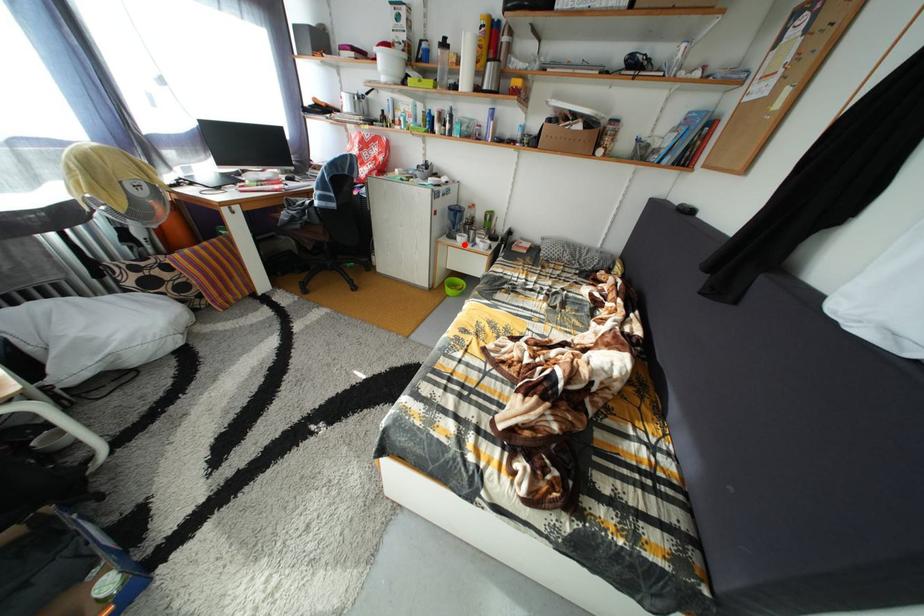
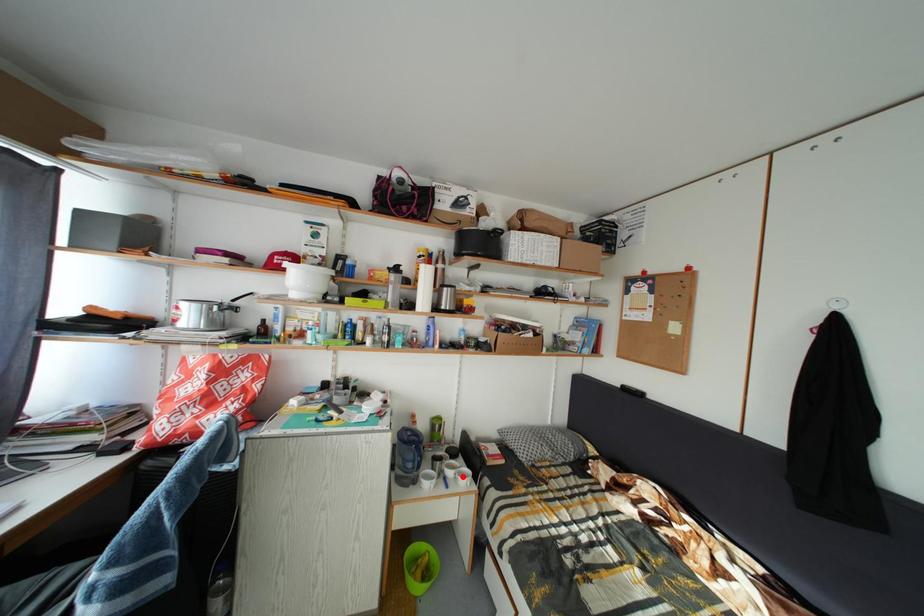
I am providing you with two images of the same scene from different viewpoints. A red point is marked on the first image and another point is marked on the second image. Is the red point in image1 aligned with the point shown in image2?

No